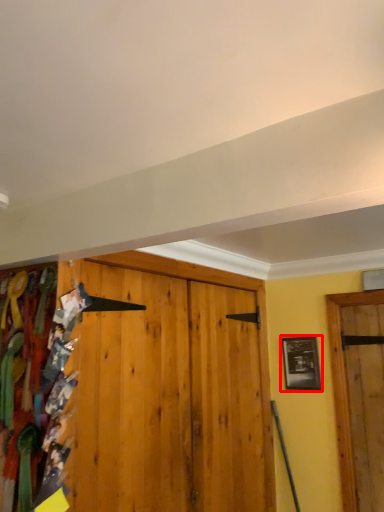
Question: From the image's perspective, considering the relative positions of picture frame (annotated by the red box) and textile in the image provided, where is picture frame (annotated by the red box) located with respect to the staircase?

Choices:
 (A) above
 (B) below

Answer: (B)